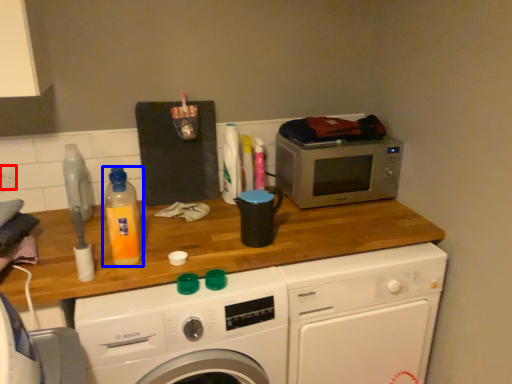
Question: Which point is further to the camera, power plugs and sockets (highlighted by a red box) or bottle (highlighted by a blue box)?

Choices:
 (A) power plugs and sockets
 (B) bottle

Answer: (A)